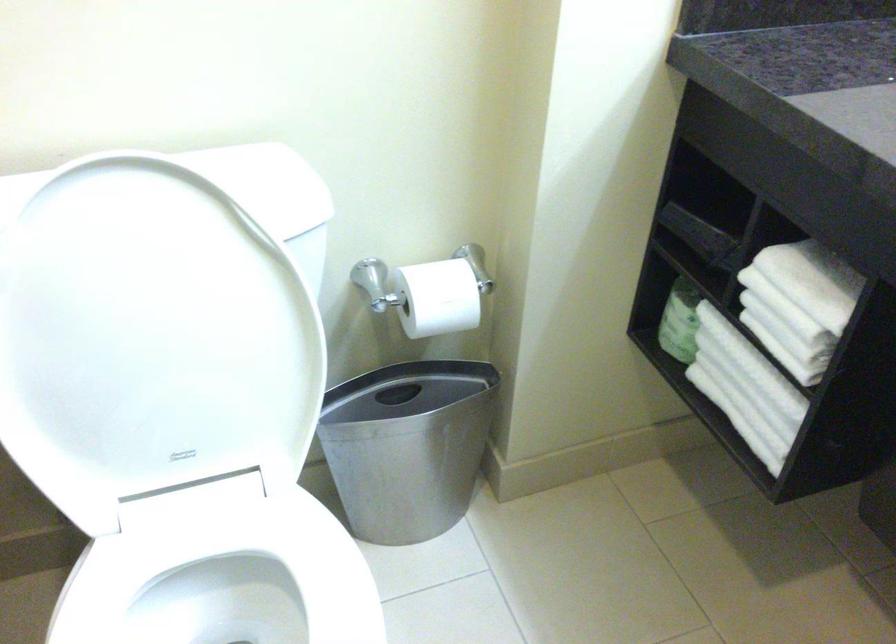
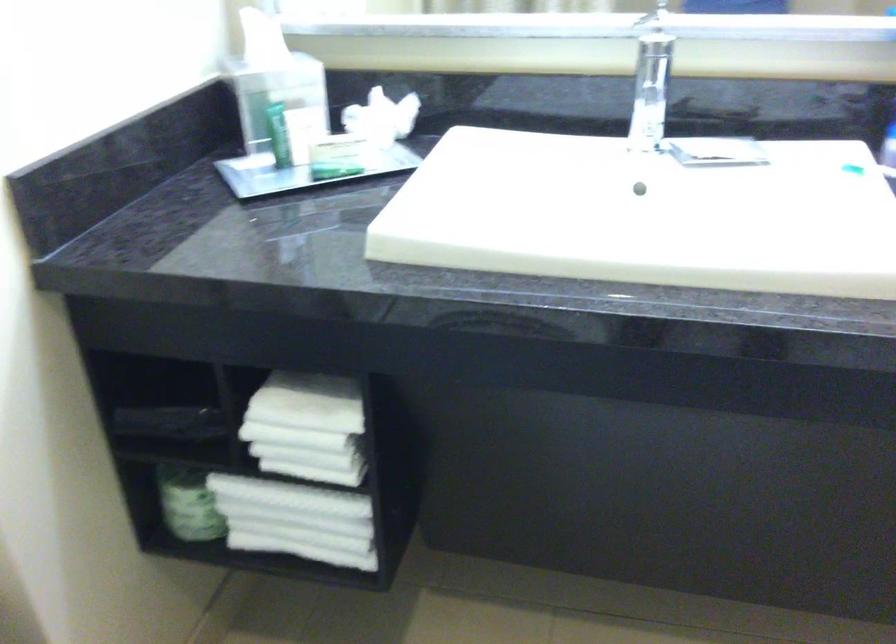
In the second image, find the point that corresponds to pixel 678 319 in the first image.

(188, 504)